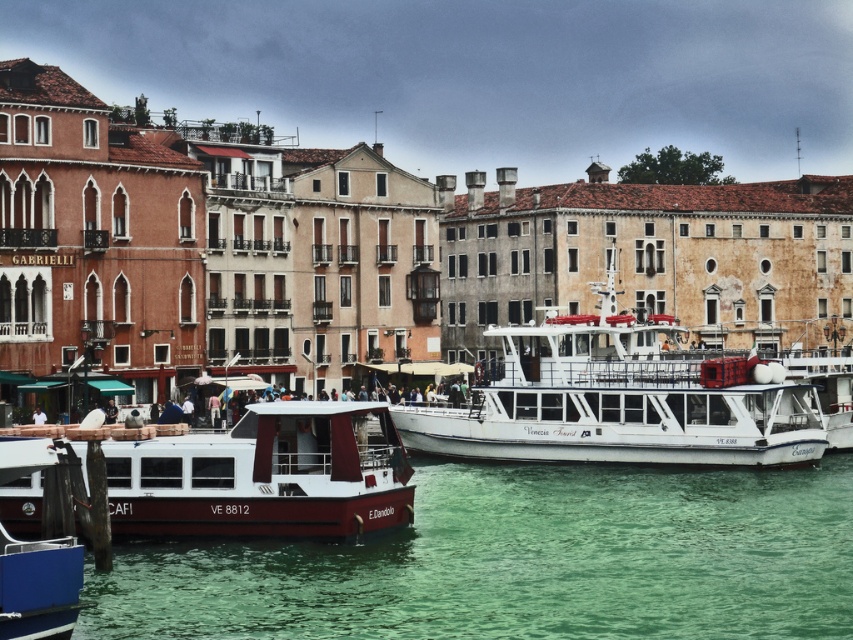
Question: Where is green translucent water at center located in relation to white glossy ferry at center in the image?

Choices:
 (A) below
 (B) above

Answer: (A)

Question: Does white glossy ferry at center lie in front of matte red boat at lower left?

Choices:
 (A) no
 (B) yes

Answer: (A)

Question: Which of the following is the closest to the observer?

Choices:
 (A) (447, 563)
 (B) (155, 451)

Answer: (A)

Question: Which object appears closest to the camera in this image?

Choices:
 (A) matte red boat at lower left
 (B) white glossy ferry at center
 (C) green translucent water at center

Answer: (C)

Question: Which point is closer to the camera?

Choices:
 (A) (361, 536)
 (B) (242, 627)
 (C) (483, 429)

Answer: (B)

Question: Where is green translucent water at center located in relation to matte red boat at lower left in the image?

Choices:
 (A) above
 (B) below

Answer: (B)